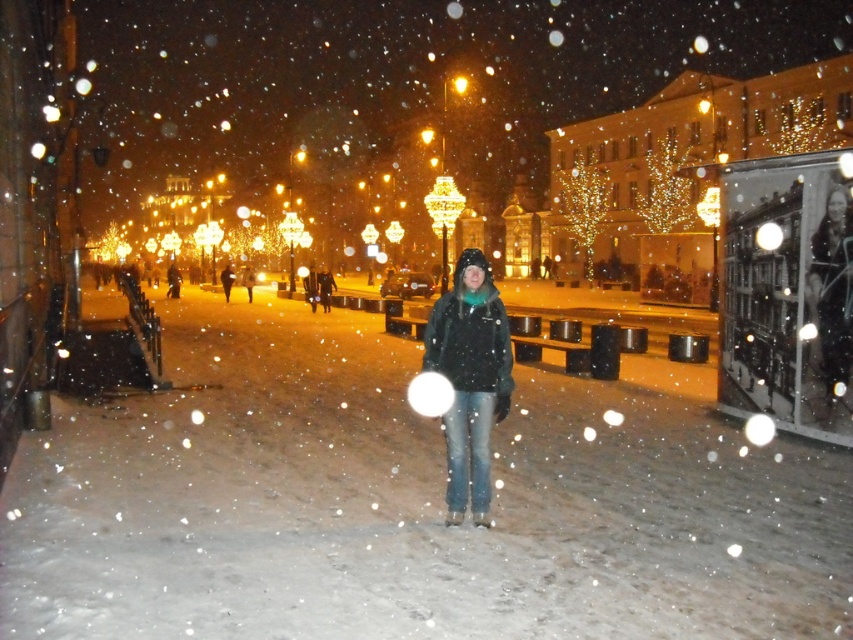
You are a photographer trying to capture both the matte black jacket at center and the dark green jacket at center in a single shot. Based on their positions, which jacket should you focus on first to ensure both are in the frame?

The matte black jacket at center is below the dark green jacket at center, so you should focus on the dark green jacket at center first to ensure both are in the frame.

You are standing in the snowy urban scene at night. You want to locate the matte black jacket at center. Based on the coordinates provided, where should you look?

The matte black jacket at center is located at coordinates point (469,380).

You are a photographer trying to capture both the matte black jacket at center and the dark green jacket at center in a single frame. Since the camera can only focus on one subject at a time, which jacket should you focus on first if you want to include both in the photo?

The matte black jacket at center is to the right of dark green jacket at center. Since the camera can focus on one subject at a time, you should focus on the dark green jacket at center first, then adjust to capture the matte black jacket at center.